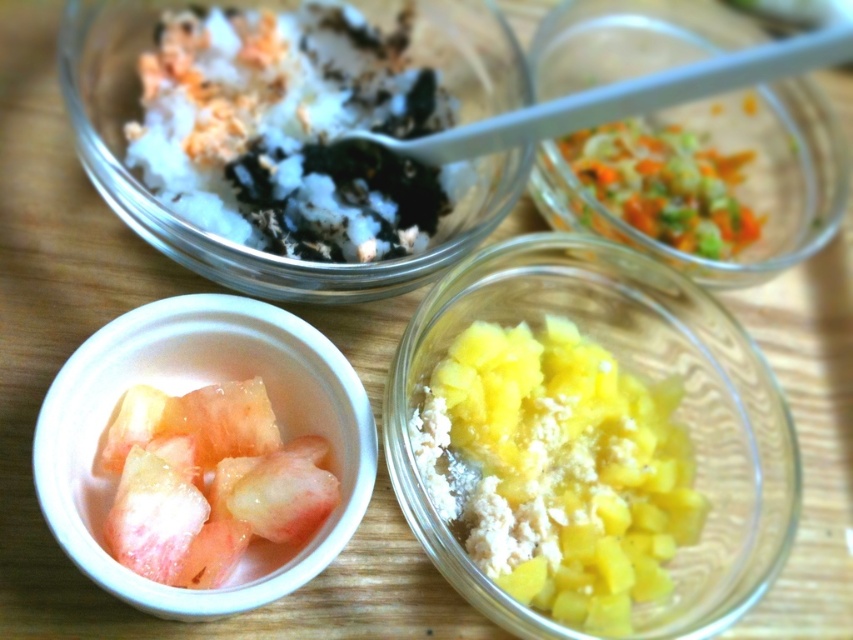
Question: Which point appears farthest from the camera in this image?

Choices:
 (A) (380, 97)
 (B) (167, 548)
 (C) (840, 211)
 (D) (720, 616)

Answer: (C)

Question: Does translucent glass bowl at upper right have a greater width compared to pink translucent fruit at bottom left?

Choices:
 (A) yes
 (B) no

Answer: (A)

Question: Among these objects, which one is nearest to the camera?

Choices:
 (A) pink translucent fruit at bottom left
 (B) white fluffy rice at upper center
 (C) translucent plastic bowl at lower left

Answer: (C)

Question: Is white fluffy rice at upper center above translucent plastic bowl at lower left?

Choices:
 (A) yes
 (B) no

Answer: (A)

Question: Considering the real-world distances, which object is farthest from the translucent plastic bowl at lower left?

Choices:
 (A) white fluffy rice at upper center
 (B) translucent glass bowl at upper right
 (C) yellow matte pineapple chunks at center
 (D) pink translucent fruit at bottom left

Answer: (B)

Question: Does yellow matte pineapple chunks at center appear on the left side of translucent glass bowl at upper right?

Choices:
 (A) no
 (B) yes

Answer: (B)